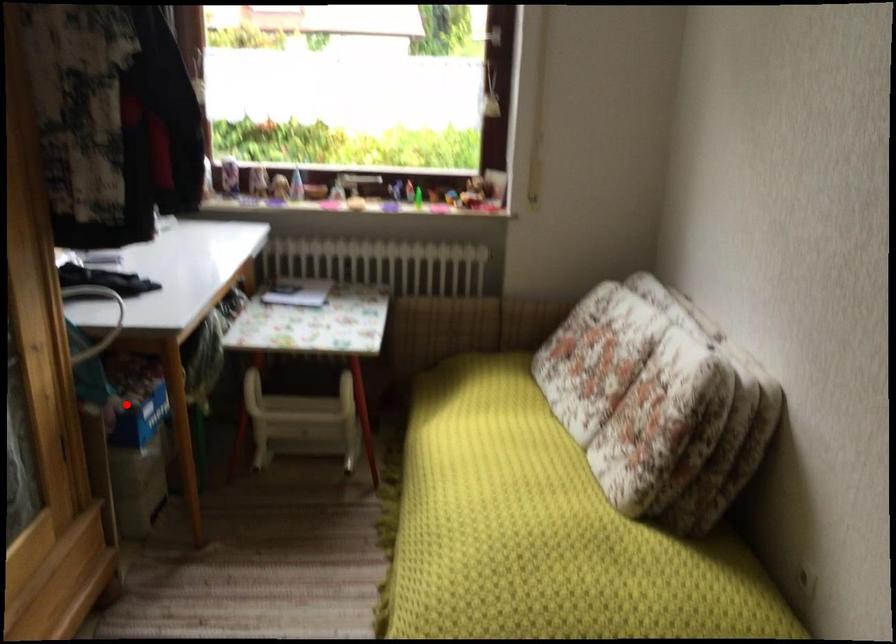
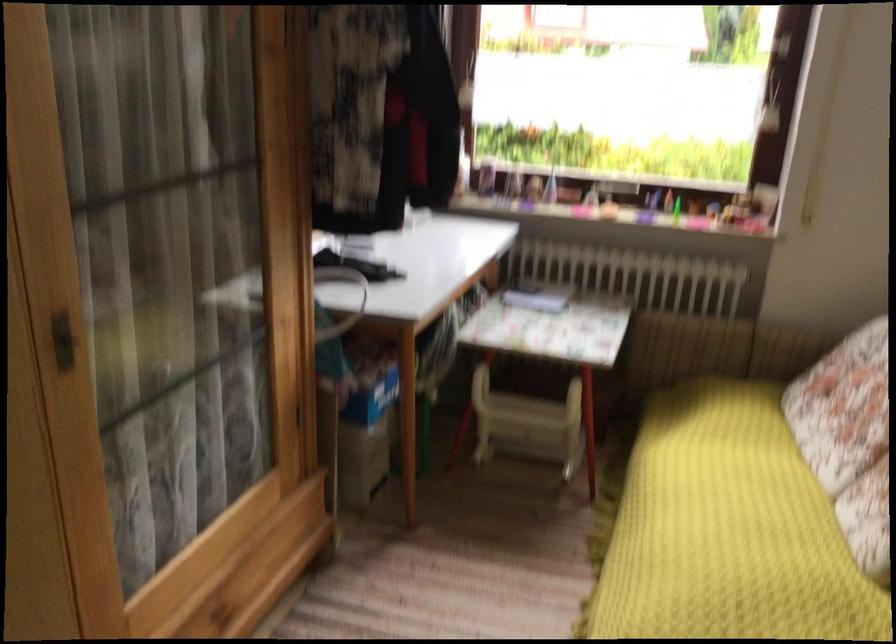
Question: I am providing you with two images of the same scene from different viewpoints. A red point is shown in image1. For the corresponding object point in image2, is it positioned nearer or farther from the camera?

Choices:
 (A) Nearer
 (B) Farther

Answer: (B)